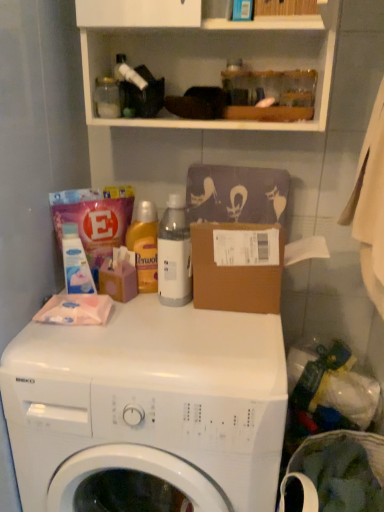
At what (x,y) coordinates should I click in order to perform the action: click on free space in front of white plastic bottle at center. Please return your answer as a coordinate pair (x, y). This screenshot has height=512, width=384. Looking at the image, I should click on (170, 331).